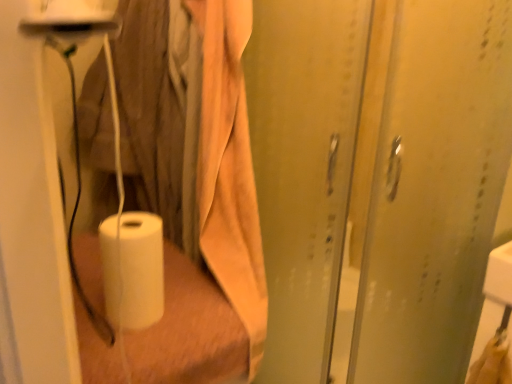
Question: Is translucent plastic screen door at center, arranged as the second screen door when viewed from the right, further to the viewer compared to transparent plastic screen door at right, acting as the 1th screen door starting from the right?

Choices:
 (A) no
 (B) yes

Answer: (A)

Question: Is translucent plastic screen door at center, positioned as the first screen door in left-to-right order, oriented away from transparent plastic screen door at right, which is the second screen door from left to right?

Choices:
 (A) no
 (B) yes

Answer: (A)

Question: Considering the relative positions of translucent plastic screen door at center, positioned as the first screen door in left-to-right order, and transparent plastic screen door at right, acting as the 1th screen door starting from the right, in the image provided, is translucent plastic screen door at center, positioned as the first screen door in left-to-right order, to the right of transparent plastic screen door at right, acting as the 1th screen door starting from the right, from the viewer's perspective?

Choices:
 (A) no
 (B) yes

Answer: (A)

Question: From a real-world perspective, is translucent plastic screen door at center, arranged as the second screen door when viewed from the right, under transparent plastic screen door at right, which is the second screen door from left to right?

Choices:
 (A) yes
 (B) no

Answer: (B)

Question: Is translucent plastic screen door at center, arranged as the second screen door when viewed from the right, far away from transparent plastic screen door at right, which is the second screen door from left to right?

Choices:
 (A) no
 (B) yes

Answer: (A)

Question: Does point (159, 228) appear closer or farther from the camera than point (269, 324)?

Choices:
 (A) farther
 (B) closer

Answer: (B)

Question: From the image's perspective, is white matte paper towel at lower left above or below translucent plastic screen door at center, arranged as the second screen door when viewed from the right?

Choices:
 (A) below
 (B) above

Answer: (A)

Question: From their relative heights in the image, would you say white matte paper towel at lower left is taller or shorter than translucent plastic screen door at center, positioned as the first screen door in left-to-right order?

Choices:
 (A) tall
 (B) short

Answer: (B)

Question: Would you say white matte paper towel at lower left is to the left or to the right of translucent plastic screen door at center, arranged as the second screen door when viewed from the right, in the picture?

Choices:
 (A) right
 (B) left

Answer: (B)

Question: Is transparent plastic screen door at right, acting as the 1th screen door starting from the right, spatially inside translucent plastic screen door at center, arranged as the second screen door when viewed from the right, or outside of it?

Choices:
 (A) outside
 (B) inside

Answer: (A)

Question: Is transparent plastic screen door at right, acting as the 1th screen door starting from the right, to the left or to the right of translucent plastic screen door at center, positioned as the first screen door in left-to-right order, in the image?

Choices:
 (A) right
 (B) left

Answer: (A)

Question: Considering the positions of transparent plastic screen door at right, acting as the 1th screen door starting from the right, and translucent plastic screen door at center, arranged as the second screen door when viewed from the right, in the image, is transparent plastic screen door at right, acting as the 1th screen door starting from the right, bigger or smaller than translucent plastic screen door at center, arranged as the second screen door when viewed from the right,?

Choices:
 (A) small
 (B) big

Answer: (B)

Question: Is transparent plastic screen door at right, acting as the 1th screen door starting from the right, wider or thinner than translucent plastic screen door at center, positioned as the first screen door in left-to-right order?

Choices:
 (A) thin
 (B) wide

Answer: (A)

Question: Is translucent plastic screen door at center, positioned as the first screen door in left-to-right order, inside or outside of transparent plastic screen door at right, which is the second screen door from left to right?

Choices:
 (A) outside
 (B) inside

Answer: (A)

Question: Is translucent plastic screen door at center, arranged as the second screen door when viewed from the right, wider or thinner than transparent plastic screen door at right, acting as the 1th screen door starting from the right?

Choices:
 (A) wide
 (B) thin

Answer: (A)